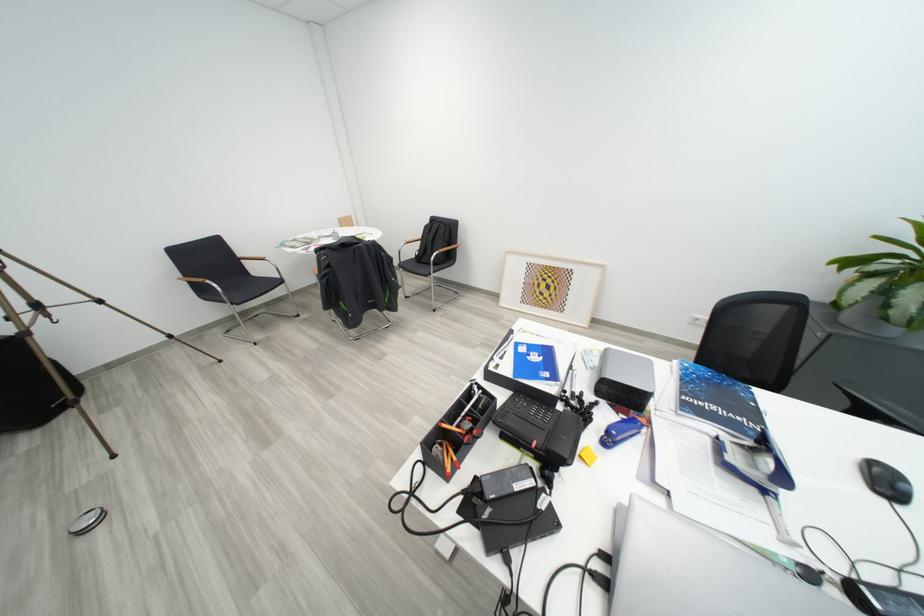
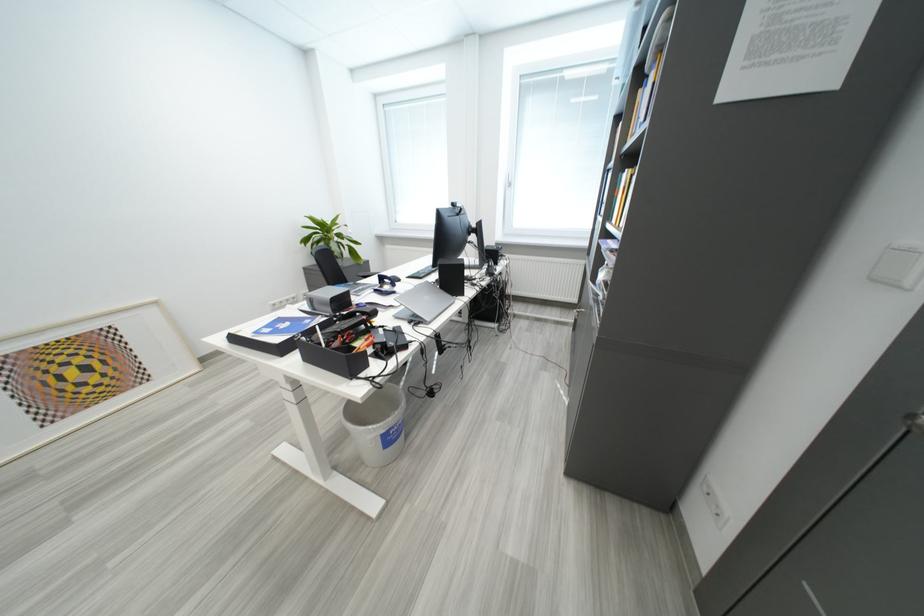
Question: I am providing you with two images of the same scene from different viewpoints. After the viewpoint changes to image2, which objects are now occluded?

Choices:
 (A) patterned white pillow
 (B) blue hole puncher
 (C) blue binder
 (D) silver cabinet lock

Answer: (B)